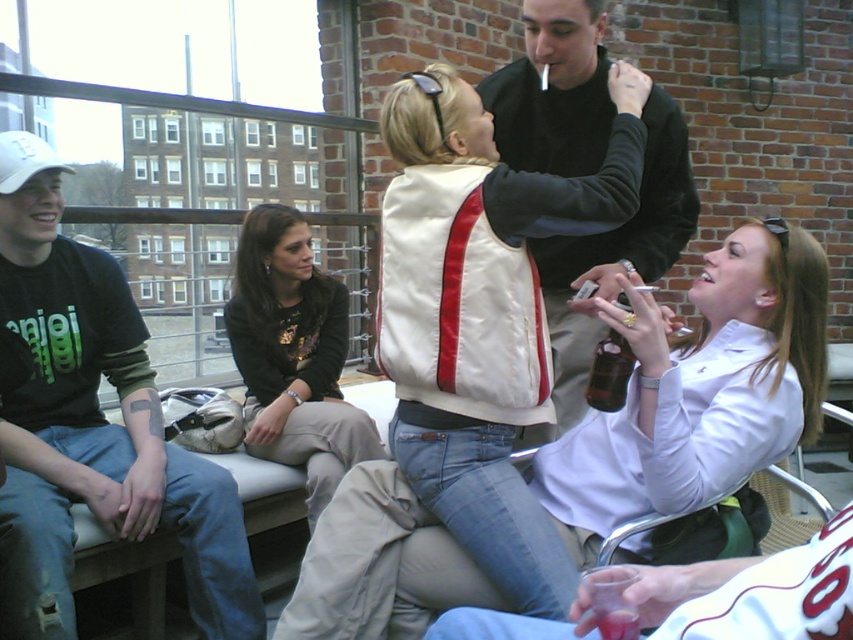
You are a photographer setting up for an event. You need to place a 1.2 meter wide backdrop behind the velvet black jacket at upper center and the dark brown leather jacket at center. Will the backdrop be wide enough to cover both jackets?

The velvet black jacket at upper center is wider than the dark brown leather jacket at center. Since the backdrop is 1.2 meters wide, it should be sufficient to cover both jackets as long as their combined width does not exceed the backdrop width. However, the exact placement and spacing between them would determine if it fully covers both.

You are at a social gathering in a lounge with a brick wall background. You see a point at coordinates (614, 257). Which object is this point located on?

The point at coordinates (614, 257) is located on the velvet black jacket at upper center.